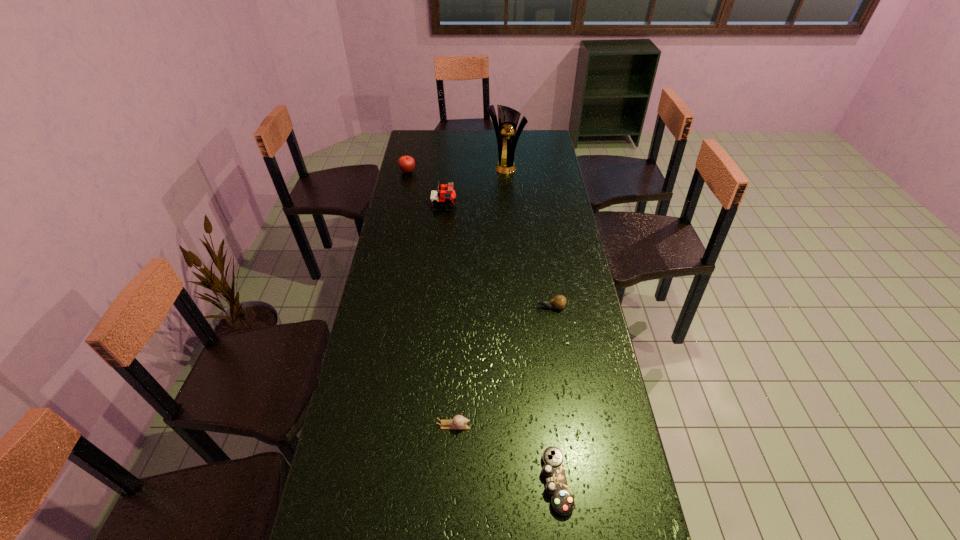
What are the coordinates of `award` in the screenshot? It's located at (508, 118).

Find the location of `the fourth nearest object`. the fourth nearest object is located at coordinates (446, 196).

Locate an element on the screen. The width and height of the screenshot is (960, 540). Lego is located at coordinates (446, 196).

The width and height of the screenshot is (960, 540). I want to click on apple, so click(406, 163).

The image size is (960, 540). I want to click on the fourth shortest object, so click(x=406, y=163).

The width and height of the screenshot is (960, 540). In order to click on the taller escargot in this screenshot , I will do `click(559, 301)`.

At what (x,y) coordinates should I click in order to perform the action: click on the right escargot. Please return your answer as a coordinate pair (x, y). The height and width of the screenshot is (540, 960). Looking at the image, I should click on (559, 301).

Identify the location of the nearer escargot. The height and width of the screenshot is (540, 960). (458, 422).

Where is `the shorter escargot`? the shorter escargot is located at coordinates (458, 422).

This screenshot has height=540, width=960. Find the location of `the shortest object`. the shortest object is located at coordinates (562, 502).